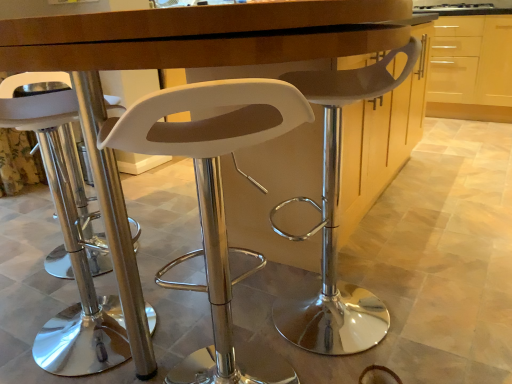
Locate an element on the screen. The image size is (512, 384). vacant region to the left of white plastic stool at left, positioned as the 3th chair in right-to-left order is located at coordinates (20, 318).